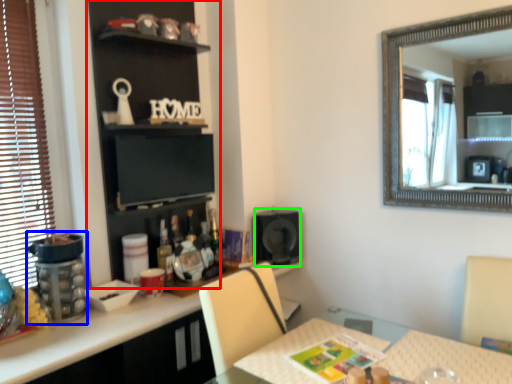
Question: Estimate the real-world distances between objects in this image. Which object is closer to bookshelf (highlighted by a red box), appliance (highlighted by a blue box) or speaker (highlighted by a green box)?

Choices:
 (A) appliance
 (B) speaker

Answer: (A)